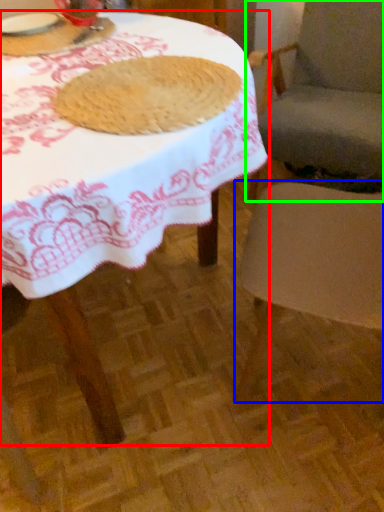
Question: Which is nearer to the table (highlighted by a red box)? chair (highlighted by a blue box) or chair (highlighted by a green box).

Choices:
 (A) chair
 (B) chair

Answer: (A)